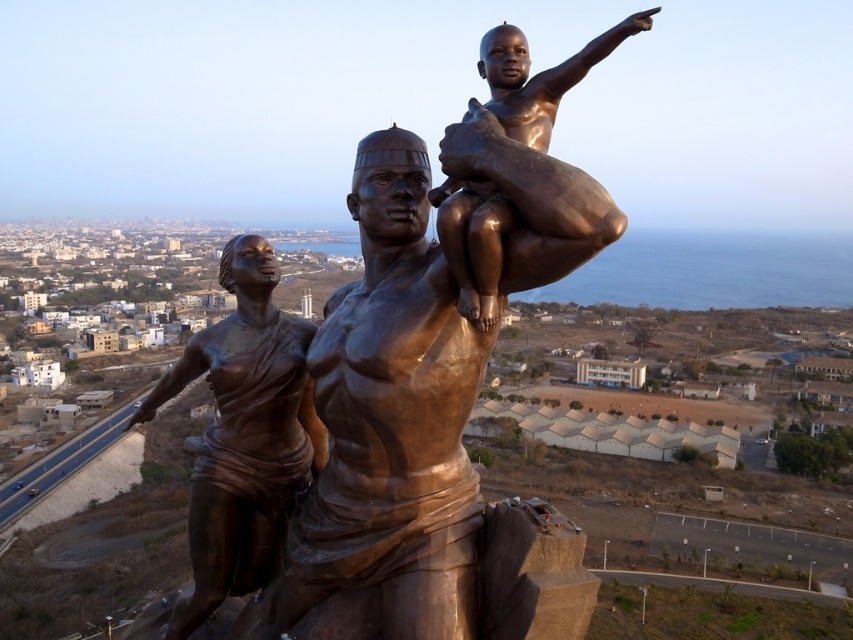
You are an art student standing in front of the city view. You notice two bronze statues in the distance. The first is the bronze statue at center, and the second is the shiny bronze statue at left. Which one is positioned more to the left side of your view?

The shiny bronze statue at left is positioned more to the left side of your view.

You are a city planner assessing the space between two bronze statues in the park. The first is the bronze statue at center and the second is the shiny bronze statue at left. If you want to place a 10 meter long bench between them, will it fit?

The distance between bronze statue at center and shiny bronze statue at left is 9.40 meters, so a 10 meter long bench would not fit between them as the space is shorter than the bench.